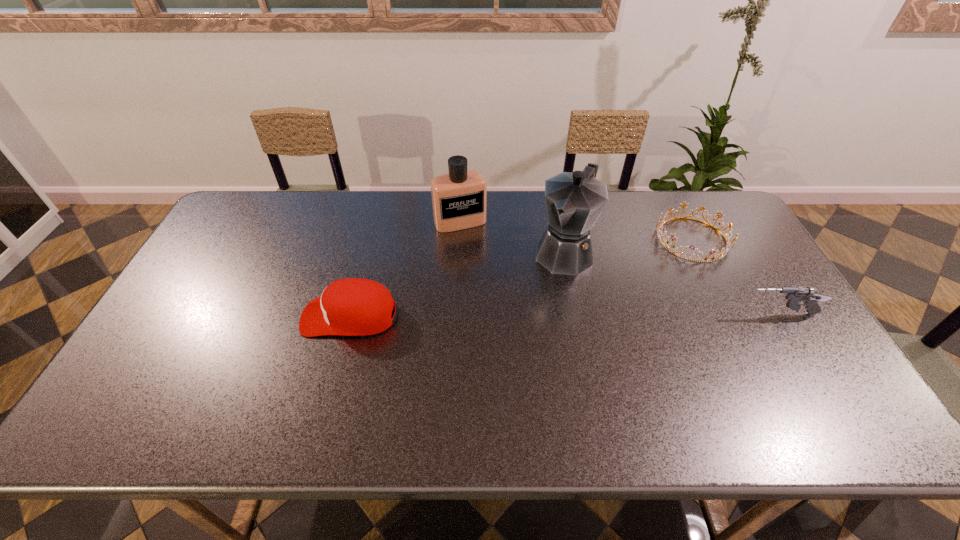
What are the coordinates of `free space on the desktop that is between the leftmost object and the gun and is positioned on the front-facing side of the tiara` in the screenshot? It's located at (554, 315).

The width and height of the screenshot is (960, 540). I want to click on free spot on the desktop that is between the leftmost object and the gun and is positioned on the front label of the fourth shortest object, so click(x=501, y=315).

Locate an element on the screen. The width and height of the screenshot is (960, 540). vacant spot on the desktop that is between the baseball cap and the gun and is positioned at the spout of the tallest object is located at coordinates (521, 315).